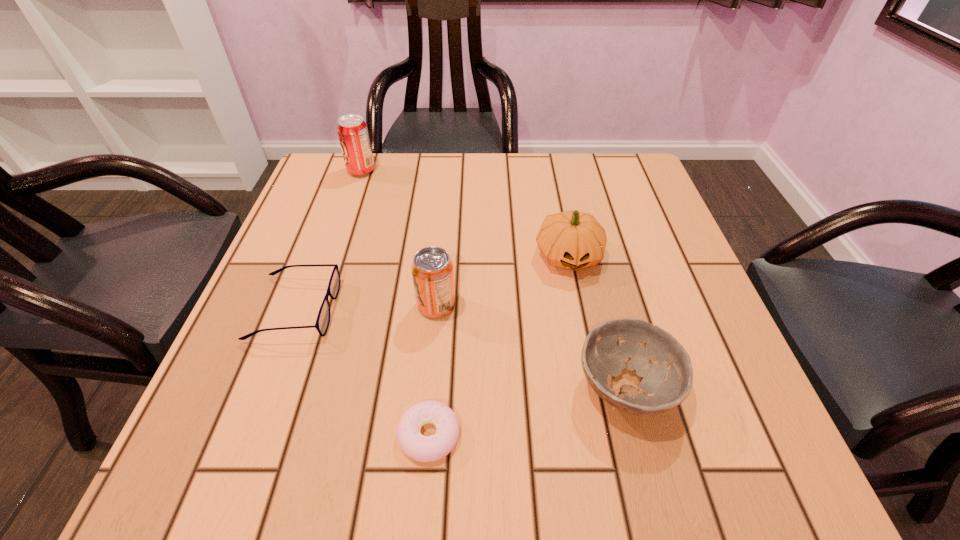
At what (x,y) coordinates should I click in order to perform the action: click on blank area in the image that satisfies the following two spatial constraints: 1. on the front-facing side of the fifth tallest object; 2. on the left side of the third shortest object. Please return your answer as a coordinate pair (x, y). The height and width of the screenshot is (540, 960). Looking at the image, I should click on (266, 387).